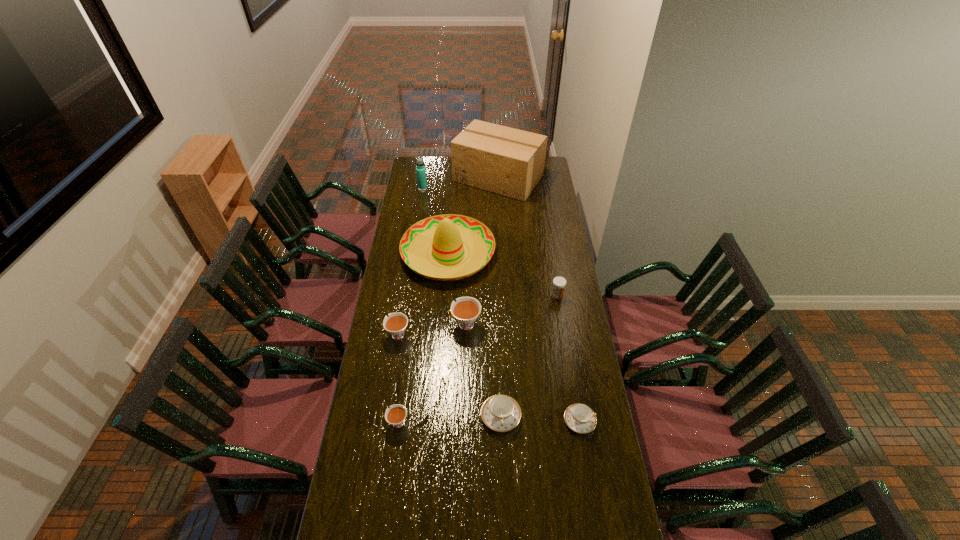
I want to click on the nearest white teacup, so click(x=396, y=415).

The height and width of the screenshot is (540, 960). Identify the location of the rightmost teacup. (580, 418).

I want to click on the right blue teacup, so click(580, 418).

Identify the location of vacant space situated 0.260m on the left of the box. (411, 178).

This screenshot has width=960, height=540. What are the coordinates of `free location located 0.390m on the front of the sombrero` in the screenshot? It's located at (441, 355).

Where is `free space located 0.220m on the front of the aqua thermos bottle`? free space located 0.220m on the front of the aqua thermos bottle is located at coordinates (419, 213).

I want to click on vacant space positioned on the side of the biggest white teacup with the handle, so click(x=419, y=324).

Identify the location of free region located 0.290m on the side of the biggest white teacup with the handle. Image resolution: width=960 pixels, height=540 pixels. (383, 324).

The image size is (960, 540). Identify the location of vacant space situated 0.280m on the side of the biggest white teacup with the handle. (385, 324).

Locate an element on the screen. The image size is (960, 540). free space located on the left of the medicine is located at coordinates (511, 295).